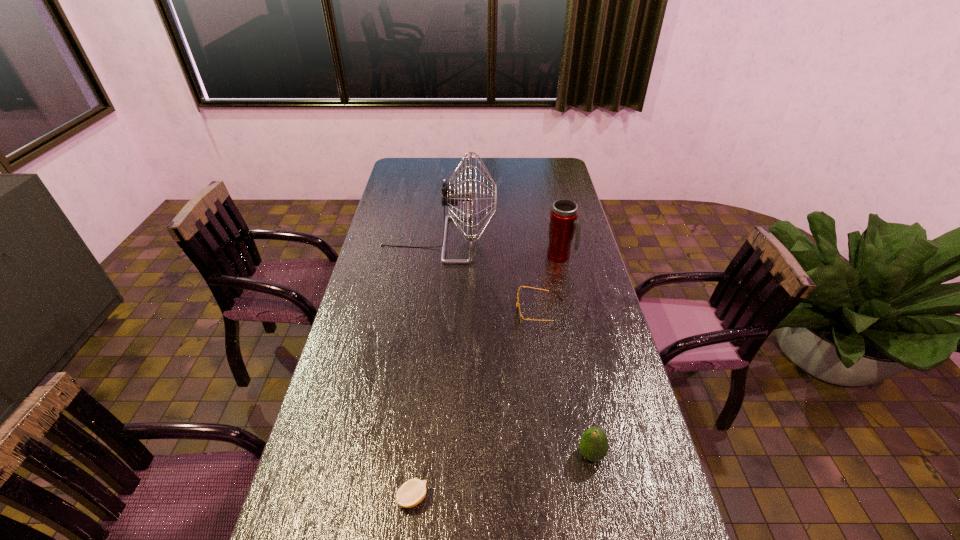
At what (x,y) coordinates should I click in order to perform the action: click on vacant space located 0.380m on the front-facing side of the sunglasses. Please return your answer as a coordinate pair (x, y). Looking at the image, I should click on (404, 313).

You are a GUI agent. You are given a task and a screenshot of the screen. Output one action in this format:
    pyautogui.click(x=<x>, y=<y>)
    Task: Click on the vacant region located 0.290m on the front-facing side of the sunglasses
    This screenshot has height=540, width=960.
    Given the screenshot: What is the action you would take?
    pyautogui.click(x=430, y=313)

Where is `vacant space located on the front-facing side of the sunglasses`? The image size is (960, 540). vacant space located on the front-facing side of the sunglasses is located at coordinates (430, 313).

You are a GUI agent. You are given a task and a screenshot of the screen. Output one action in this format:
    pyautogui.click(x=<x>, y=<y>)
    Task: Click on the free spot located 0.170m on the right of the lemon
    The image size is (960, 540).
    Given the screenshot: What is the action you would take?
    pyautogui.click(x=499, y=498)

This screenshot has width=960, height=540. Find the location of `object that is positioned at the left edge`. object that is positioned at the left edge is located at coordinates (451, 197).

Locate an element on the screen. This screenshot has height=540, width=960. thermos bottle that is positioned at the right edge is located at coordinates (563, 219).

The height and width of the screenshot is (540, 960). In order to click on avocado that is positioned at the right edge in this screenshot , I will do `click(594, 445)`.

Where is `sunglasses at the right edge`? This screenshot has height=540, width=960. sunglasses at the right edge is located at coordinates (519, 314).

You are a GUI agent. You are given a task and a screenshot of the screen. Output one action in this format:
    pyautogui.click(x=<x>, y=<y>)
    Task: Click on the free space at the far edge
    
    Given the screenshot: What is the action you would take?
    pyautogui.click(x=445, y=163)

At what (x,y) coordinates should I click in order to perform the action: click on free space at the left edge of the desktop. Please return your answer as a coordinate pair (x, y). The height and width of the screenshot is (540, 960). Looking at the image, I should click on (388, 216).